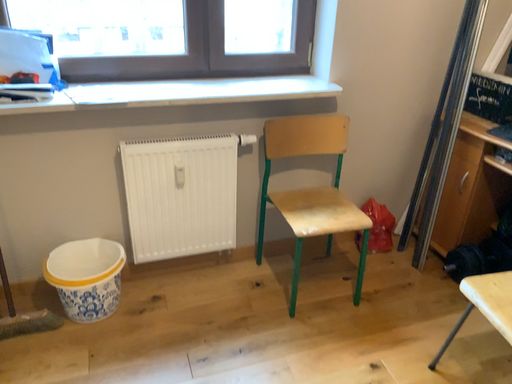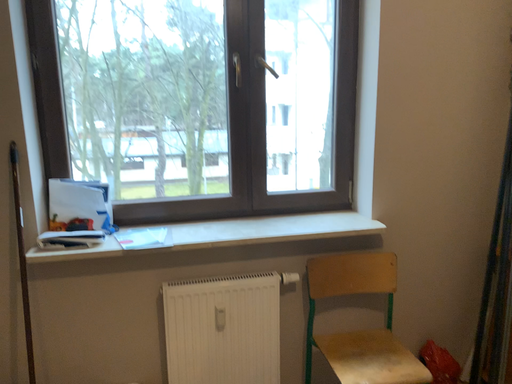
Question: How did the camera likely rotate when shooting the video?

Choices:
 (A) rotated downward
 (B) rotated upward

Answer: (B)